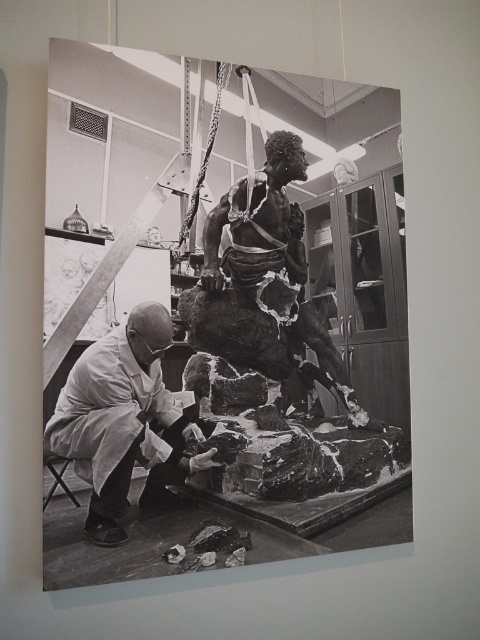
You are an assistant in the workshop and need to determine if the white lab coat at lower left can be placed on the rough stone statue at center without overlapping. Based on their sizes, is this possible?

The white lab coat at lower left is narrower than the rough stone statue at center, so it can be placed on top without overlapping as long as the statue is wide enough to accommodate the coat.

You are a visitor standing in front of the sculpture in the workshop. The white lab coat at lower left belongs to the sculptor. If you want to hand him a tool without moving from your current position, can you reach him?

The white lab coat at lower left is 5.21 feet away from viewer. Since the distance is about 5.21 feet, it is unlikely you can reach him without moving closer.

You are a safety inspector in the workshop. You need to ensure that the white lab coat at lower left is kept at least 18 inches away from the rough stone statue at center to prevent contamination. Based on the current distance, is this requirement met?

The distance between the white lab coat at lower left and the rough stone statue at center is 15.96 inches, which is less than the required 18 inches. Therefore, the safety requirement is not met.